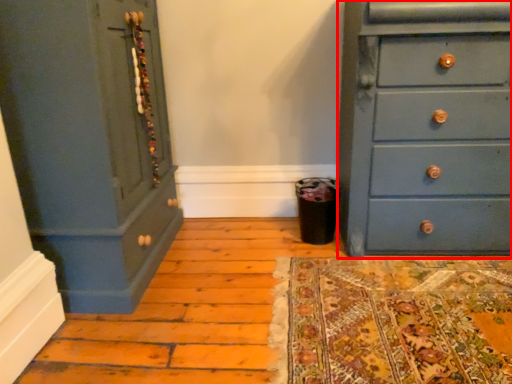
Question: From the image's perspective, considering the relative positions of chest of drawers (annotated by the red box) and chest of drawers in the image provided, where is chest of drawers (annotated by the red box) located with respect to the staircase?

Choices:
 (A) below
 (B) above

Answer: (B)